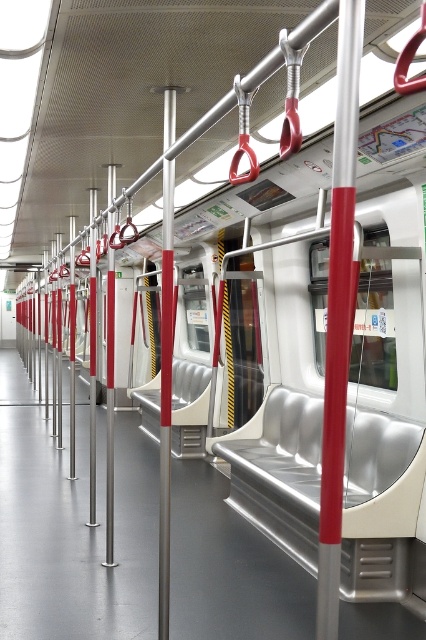
Question: Which object is closer to the camera taking this photo?

Choices:
 (A) metallic red pole at center
 (B) metallic silver pole at center

Answer: (A)

Question: Which of the following is the closest to the observer?

Choices:
 (A) metallic red pole at center
 (B) metallic silver pole at center

Answer: (A)

Question: Can you confirm if metallic red pole at center is wider than metallic silver pole at center?

Choices:
 (A) yes
 (B) no

Answer: (A)

Question: Can you confirm if metallic red pole at center is positioned to the right of metallic silver pole at center?

Choices:
 (A) no
 (B) yes

Answer: (B)

Question: Is metallic red pole at center above metallic silver pole at center?

Choices:
 (A) no
 (B) yes

Answer: (B)